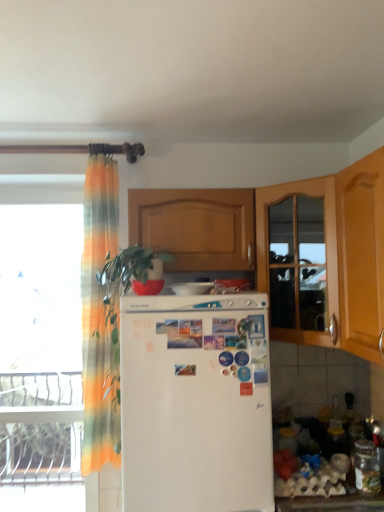
Question: Does white matte refrigerator at center have a larger size compared to transparent glass window at left?

Choices:
 (A) no
 (B) yes

Answer: (B)

Question: From a real-world perspective, is white matte refrigerator at center positioned over transparent glass window at left based on gravity?

Choices:
 (A) no
 (B) yes

Answer: (A)

Question: Are white matte refrigerator at center and transparent glass window at left located far from each other?

Choices:
 (A) yes
 (B) no

Answer: (A)

Question: Does white matte refrigerator at center come behind transparent glass window at left?

Choices:
 (A) yes
 (B) no

Answer: (B)

Question: Are white matte refrigerator at center and transparent glass window at left making contact?

Choices:
 (A) no
 (B) yes

Answer: (A)

Question: In terms of size, does transparent glass window at left appear bigger or smaller than translucent orange-green curtain at left?

Choices:
 (A) small
 (B) big

Answer: (A)

Question: Considering the positions of point (36, 245) and point (107, 455), is point (36, 245) closer or farther from the camera than point (107, 455)?

Choices:
 (A) farther
 (B) closer

Answer: (A)

Question: From a real-world perspective, is transparent glass window at left above or below translucent orange-green curtain at left?

Choices:
 (A) above
 (B) below

Answer: (B)

Question: From the image's perspective, is transparent glass window at left above or below translucent orange-green curtain at left?

Choices:
 (A) above
 (B) below

Answer: (B)

Question: Which is correct: wooden cabinet at right is inside transparent glass window at left, or outside of it?

Choices:
 (A) inside
 (B) outside

Answer: (B)

Question: In terms of width, does wooden cabinet at right look wider or thinner when compared to transparent glass window at left?

Choices:
 (A) thin
 (B) wide

Answer: (B)

Question: Considering the positions of wooden cabinet at right and transparent glass window at left in the image, is wooden cabinet at right taller or shorter than transparent glass window at left?

Choices:
 (A) tall
 (B) short

Answer: (B)

Question: Does point (281, 197) appear closer or farther from the camera than point (77, 465)?

Choices:
 (A) farther
 (B) closer

Answer: (B)

Question: Based on their sizes in the image, would you say wooden cabinet at center is bigger or smaller than white glossy refrigerator at center?

Choices:
 (A) small
 (B) big

Answer: (B)

Question: Choose the correct answer: Is wooden cabinet at center inside white glossy refrigerator at center or outside it?

Choices:
 (A) outside
 (B) inside

Answer: (A)